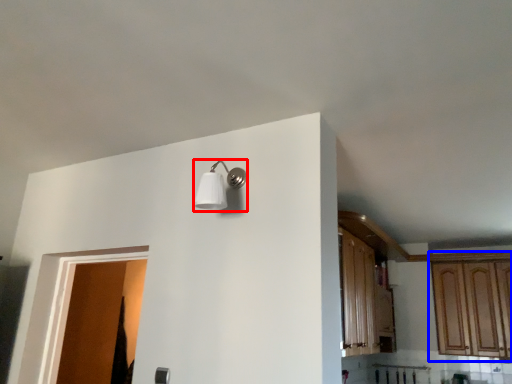
Question: Which object appears farthest to the camera in this image, light fixture (highlighted by a red box) or cabinetry (highlighted by a blue box)?

Choices:
 (A) light fixture
 (B) cabinetry

Answer: (B)